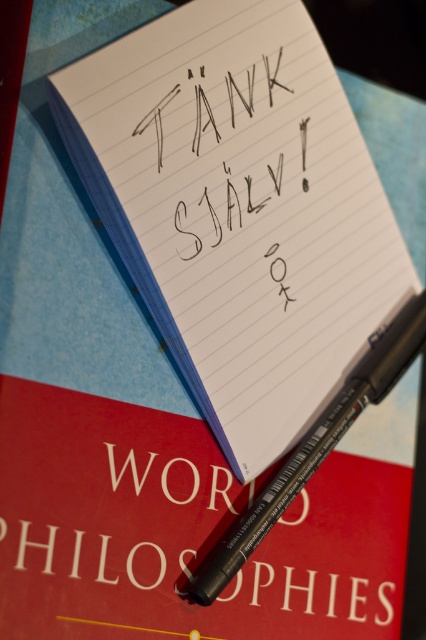
From the picture: You are trying to write a note using the black matte pen at lower center on the white lined paper at center. Can you fit the entire pen vertically on the paper?

The white lined paper at center has a greater height compared to the black matte pen at lower center, so yes, the entire pen can fit vertically on the paper.